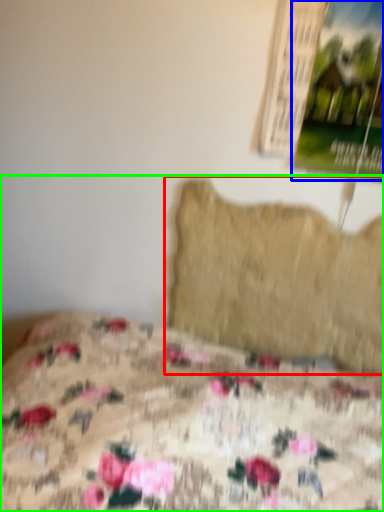
Question: Considering the real-world distances, which object is farthest from pillow (highlighted by a red box)? poster page (highlighted by a blue box) or bed (highlighted by a green box)?

Choices:
 (A) poster page
 (B) bed

Answer: (B)